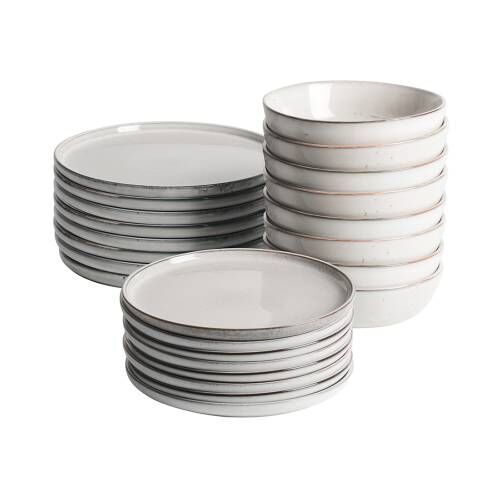
Find the location of a particular element. The height and width of the screenshot is (500, 500). white bowls is located at coordinates (403, 307), (383, 285), (387, 255), (384, 235), (385, 207), (388, 187), (389, 157), (385, 134).